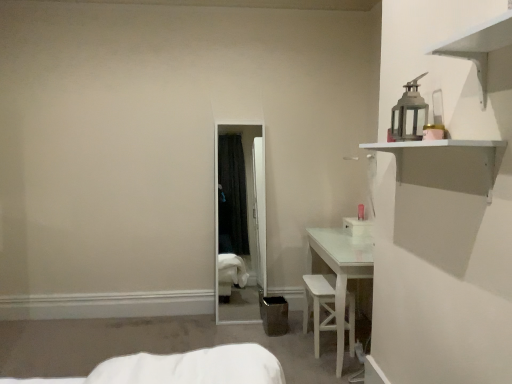
What do you see at coordinates (447, 163) in the screenshot? I see `white matte shelf at upper right` at bounding box center [447, 163].

Identify the location of white matte shelf at upper right. (447, 163).

Image resolution: width=512 pixels, height=384 pixels. What do you see at coordinates (319, 304) in the screenshot?
I see `white wood chair at lower center` at bounding box center [319, 304].

Measure the distance between white wood chair at lower center and camera.

white wood chair at lower center and camera are 2.67 meters apart.

Locate an element on the screen. The height and width of the screenshot is (384, 512). white wood chair at lower center is located at coordinates (319, 304).

The image size is (512, 384). I want to click on white matte shelf at upper right, so click(447, 163).

Which object is positioned more to the right, white matte shelf at upper right or white wood chair at lower center?

white matte shelf at upper right is more to the right.

Which is behind, white matte shelf at upper right or white wood chair at lower center?

white wood chair at lower center is further from the camera.

Considering the points (442, 175) and (318, 320), which point is behind, point (442, 175) or point (318, 320)?

The point (318, 320) is behind.

From the image's perspective, relative to white wood chair at lower center, is white matte shelf at upper right above or below?

white matte shelf at upper right is above white wood chair at lower center.

From a real-world perspective, which object stands above the other?

From a 3D spatial view, white matte shelf at upper right is above.

Which of these two, white matte shelf at upper right or white wood chair at lower center, is wider?

white wood chair at lower center.

Does white matte shelf at upper right have a lesser height compared to white wood chair at lower center?

Correct, white matte shelf at upper right is not as tall as white wood chair at lower center.

Is white matte shelf at upper right bigger or smaller than white wood chair at lower center?

In the image, white matte shelf at upper right appears to be smaller than white wood chair at lower center.

Is white matte shelf at upper right outside of white wood chair at lower center?

Absolutely, white matte shelf at upper right is external to white wood chair at lower center.

Based on the photo, is white matte shelf at upper right far away from white wood chair at lower center?

Yes, white matte shelf at upper right is far from white wood chair at lower center.

Is white wood chair at lower center at the back of white matte shelf at upper right?

No, white matte shelf at upper right is not facing the opposite direction of white wood chair at lower center.

How far apart are white matte shelf at upper right and white wood chair at lower center?

white matte shelf at upper right is 4.03 feet from white wood chair at lower center.

You are a GUI agent. You are given a task and a screenshot of the screen. Output one action in this format:
    pyautogui.click(x=<x>, y=<y>)
    Task: Click on the armchair behind the white matte shelf at upper right
    The width and height of the screenshot is (512, 384).
    Given the screenshot: What is the action you would take?
    pyautogui.click(x=319, y=304)

In the scene shown: Does white wood chair at lower center appear on the right side of white matte shelf at upper right?

Incorrect, white wood chair at lower center is not on the right side of white matte shelf at upper right.

Considering the relative positions of white wood chair at lower center and white matte shelf at upper right in the image provided, is white wood chair at lower center in front of white matte shelf at upper right?

No, it is not.

Does point (335, 312) come closer to viewer compared to point (471, 189)?

No, (335, 312) is further to viewer.

From the image's perspective, is white wood chair at lower center located beneath white matte shelf at upper right?

Correct, white wood chair at lower center appears lower than white matte shelf at upper right in the image.

From a real-world perspective, is white wood chair at lower center positioned above or below white matte shelf at upper right?

Clearly, from a real-world perspective, white wood chair at lower center is below white matte shelf at upper right.

Looking at their sizes, would you say white wood chair at lower center is wider or thinner than white matte shelf at upper right?

Clearly, white wood chair at lower center has more width compared to white matte shelf at upper right.

Can you confirm if white wood chair at lower center is shorter than white matte shelf at upper right?

In fact, white wood chair at lower center may be taller than white matte shelf at upper right.

In the scene shown: Can you confirm if white wood chair at lower center is smaller than white matte shelf at upper right?

No.

In the scene shown: Is white wood chair at lower center inside the boundaries of white matte shelf at upper right, or outside?

white wood chair at lower center is spatially situated outside white matte shelf at upper right.

Is white wood chair at lower center not near white matte shelf at upper right?

Indeed, white wood chair at lower center is not near white matte shelf at upper right.

Is white wood chair at lower center looking in the opposite direction of white matte shelf at upper right?

white wood chair at lower center does not have its back to white matte shelf at upper right.

How different are the orientations of white wood chair at lower center and white matte shelf at upper right in degrees?

white wood chair at lower center and white matte shelf at upper right are facing 0.308 degrees away from each other.

How much distance is there between white wood chair at lower center and white matte shelf at upper right?

white wood chair at lower center is 4.03 feet away from white matte shelf at upper right.

Find the location of a particular element. shelf that is above the white wood chair at lower center (from the image's perspective) is located at coordinates (447, 163).

Identify the location of armchair below the white matte shelf at upper right (from the image's perspective). The width and height of the screenshot is (512, 384). (319, 304).

This screenshot has width=512, height=384. I want to click on shelf above the white wood chair at lower center (from a real-world perspective), so click(447, 163).